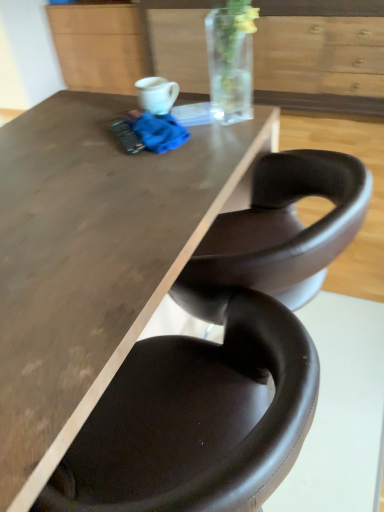
Locate an element on the screen. The image size is (384, 512). vacant space situated above brown leather chair at lower center (from a real-world perspective) is located at coordinates (99, 320).